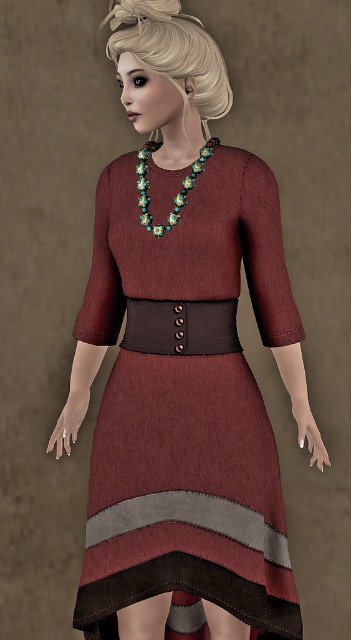
Can you confirm if maroon woolen dress at center is positioned below beaded floral necklace at center?

Indeed, maroon woolen dress at center is positioned under beaded floral necklace at center.

Can you confirm if maroon woolen dress at center is taller than beaded floral necklace at center?

Correct, maroon woolen dress at center is much taller as beaded floral necklace at center.

Does point (115, 236) come closer to viewer compared to point (202, 154)?

Yes, it is in front of point (202, 154).

The height and width of the screenshot is (640, 351). What are the coordinates of `maroon woolen dress at center` in the screenshot? It's located at (187, 401).